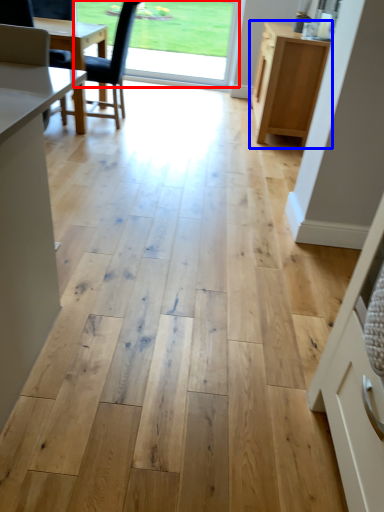
Question: Which object is closer to the camera taking this photo, window screen (highlighted by a red box) or cabinetry (highlighted by a blue box)?

Choices:
 (A) window screen
 (B) cabinetry

Answer: (B)